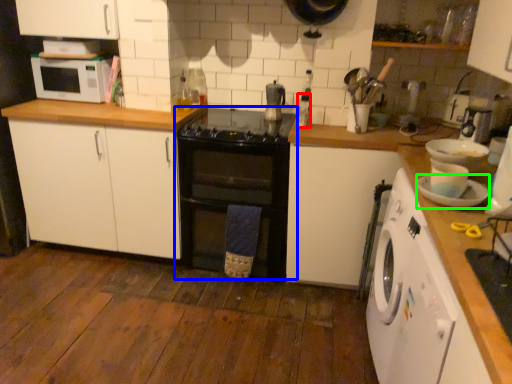
Question: Which is farther away from appliance (highlighted by a red box)? oven (highlighted by a blue box) or appliance (highlighted by a green box)?

Choices:
 (A) oven
 (B) appliance

Answer: (B)